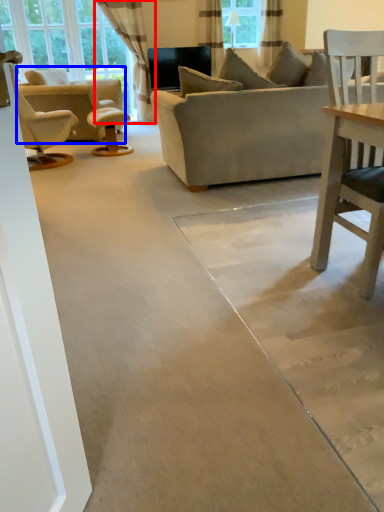
Question: Which object appears farthest to the camera in this image, curtain (highlighted by a red box) or chair (highlighted by a blue box)?

Choices:
 (A) curtain
 (B) chair

Answer: (A)